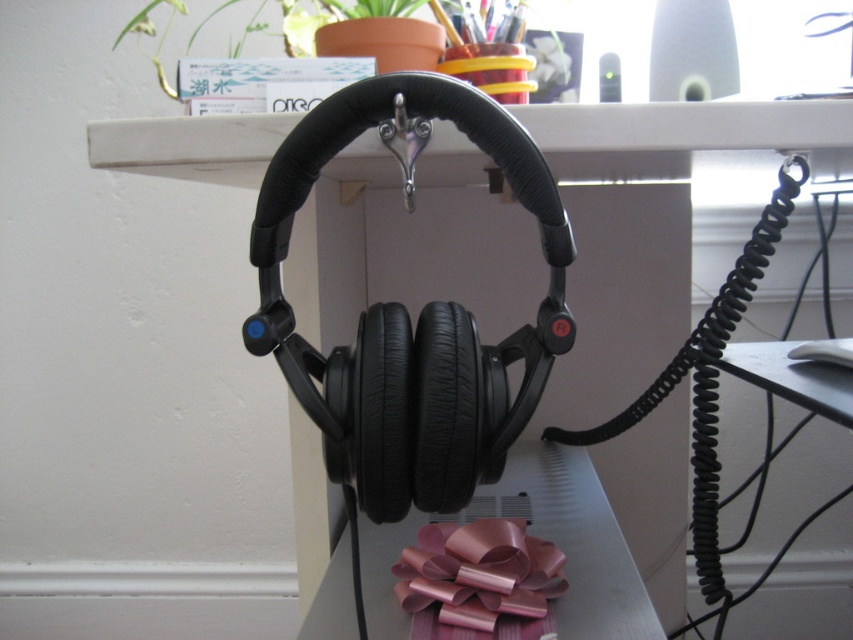
Question: Which of the following is the farthest from the observer?

Choices:
 (A) coord(492,596)
 (B) coord(648,598)

Answer: (B)

Question: Where is metallic pink bow at lower center located in relation to pink shiny ribbon at lower center in the image?

Choices:
 (A) left
 (B) right

Answer: (B)

Question: Does metallic pink bow at lower center have a smaller size compared to pink shiny ribbon at lower center?

Choices:
 (A) no
 (B) yes

Answer: (A)

Question: Where is metallic pink bow at lower center located in relation to pink shiny ribbon at lower center in the image?

Choices:
 (A) above
 (B) below

Answer: (B)

Question: Which object appears farthest from the camera in this image?

Choices:
 (A) pink shiny ribbon at lower center
 (B) metallic pink bow at lower center

Answer: (A)